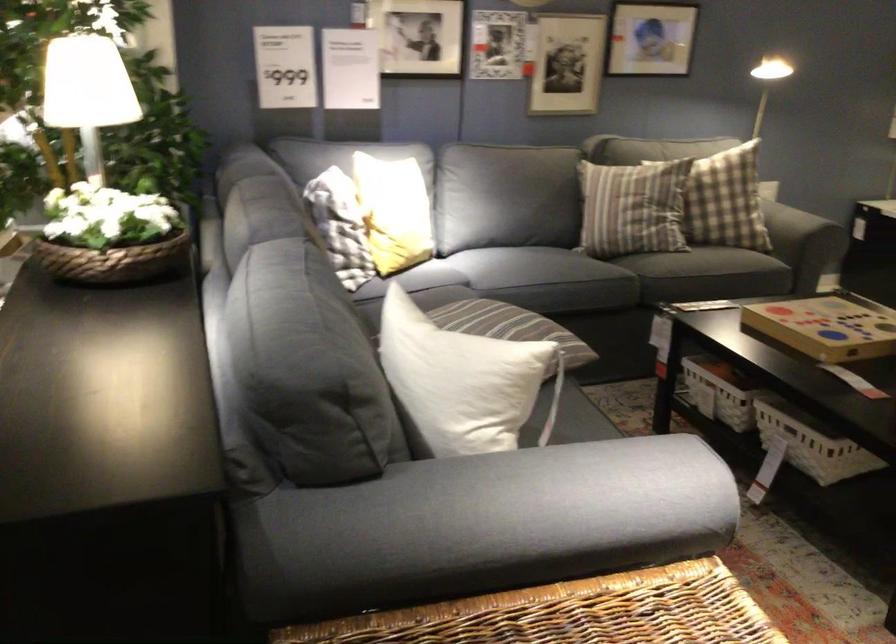
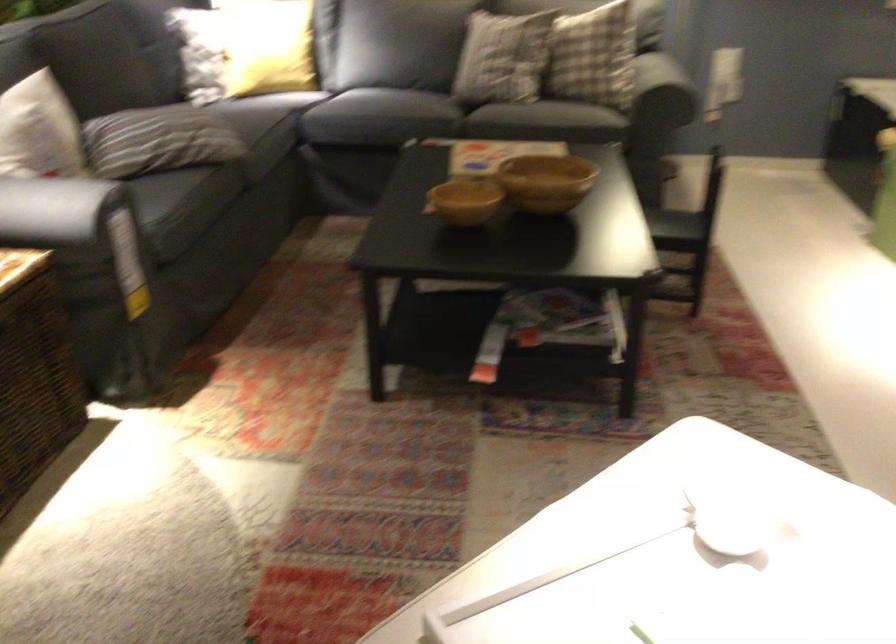
Question: In a continuous first-person perspective shot, in which direction is the camera moving?

Choices:
 (A) Left
 (B) Right
 (C) Forward
 (D) Backward

Answer: (B)